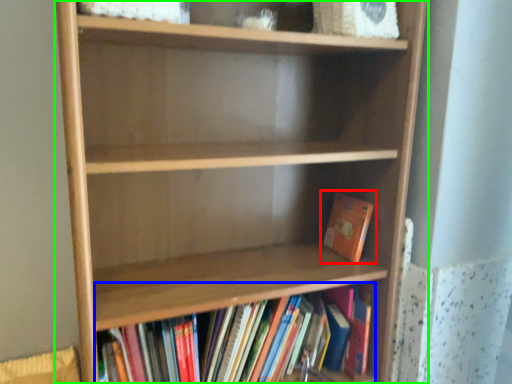
Question: Considering the real-world distances, which object is closest to book (highlighted by a red box)? book (highlighted by a blue box) or shelf (highlighted by a green box).

Choices:
 (A) book
 (B) shelf

Answer: (A)